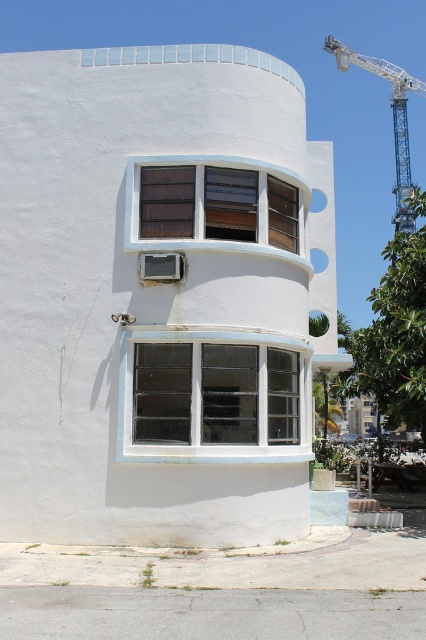
You are standing in front of the modernist building and want to locate the white textured glass window at center. Based on the building structure, where would you find it?

The white textured glass window at center is located at the 2D coordinates point (206, 397) on the building structure.

You are an architect examining the modernist building. You need to install a new light fixture between the brown wood window at center and the blue metallic crane at upper right. Based on their positions, which object should the light fixture be closer to?

The brown wood window at center is positioned on the left side of blue metallic crane at upper right, so the light fixture should be closer to the blue metallic crane at upper right to maintain symmetry between the two objects.

You are standing in front of the modernist building and want to determine the spatial relationship between two points marked on the structure. Which point, point 1 at coordinates [167,426] or point 2 at [394,88], is closer to you?

Point 1 at coordinates [167,426] is closer to you because it is in front of point 2 at [394,88].